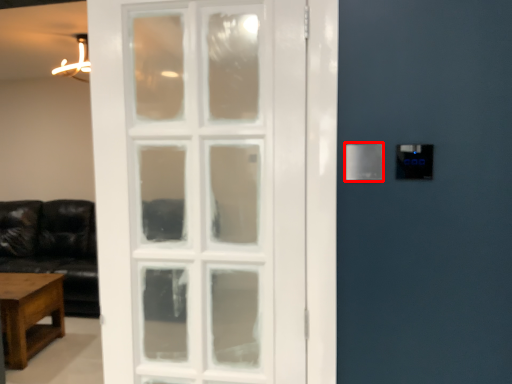
Question: Considering the relative positions of light switch (annotated by the red box) and table in the image provided, where is light switch (annotated by the red box) located with respect to the staircase?

Choices:
 (A) right
 (B) left

Answer: (A)